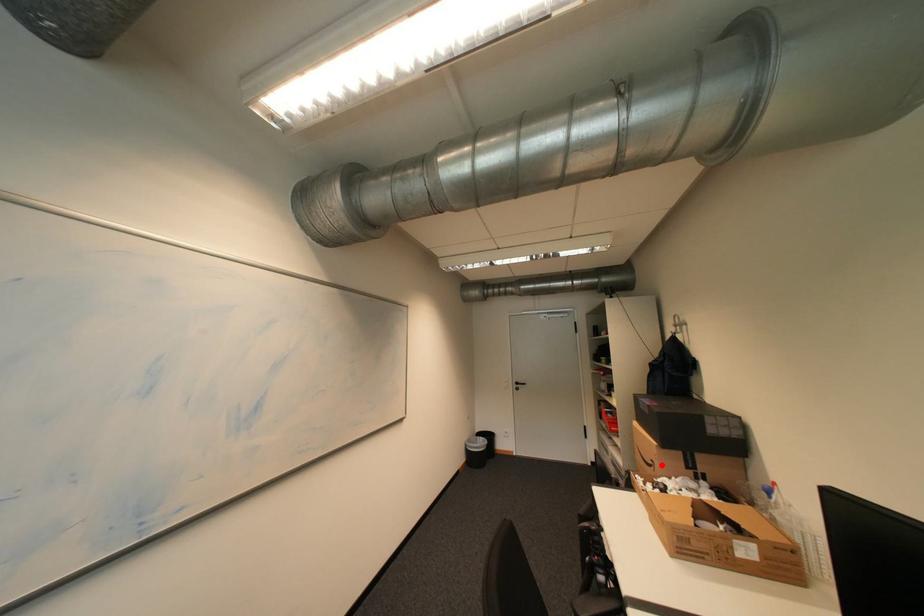
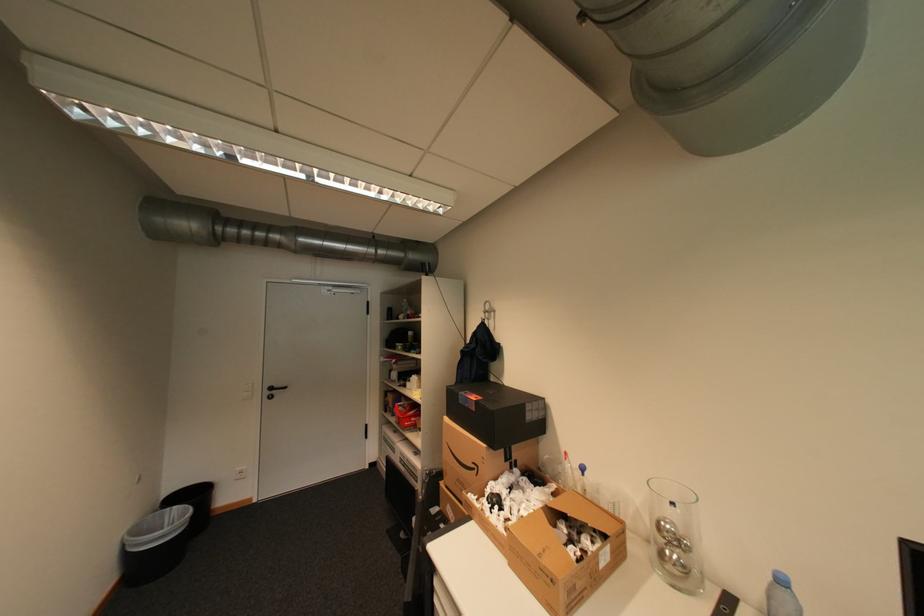
Question: I am providing you with two images of the same scene from different viewpoints. Given a red point in image1, look at the same physical point in image2. Is it:

Choices:
 (A) Closer to the viewpoint
 (B) Farther from the viewpoint

Answer: (B)